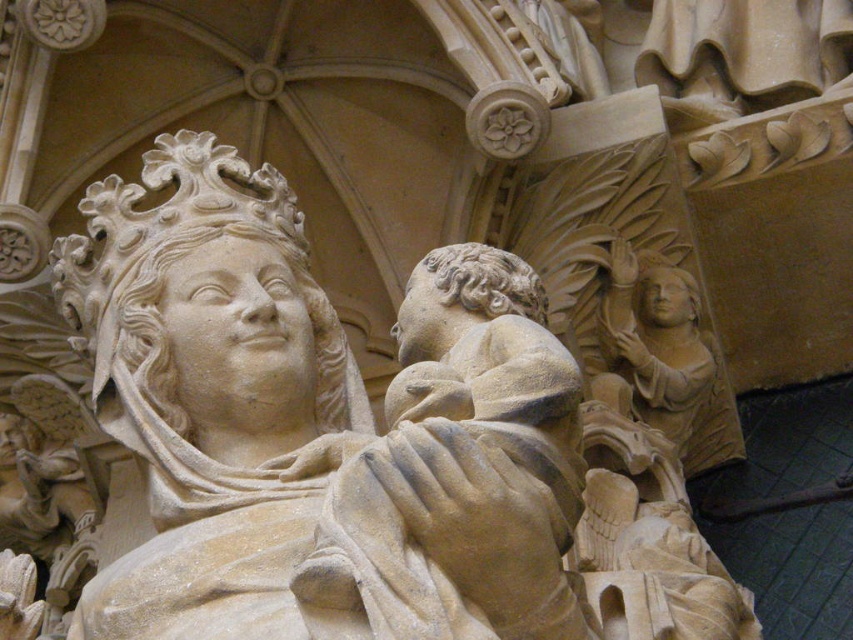
From the picture: Between stone statue of woman holding child at center and beige stone angel at right, which one is positioned higher?

Positioned higher is beige stone angel at right.

Between point (398, 406) and point (669, 280), which one is positioned behind?

The point (669, 280) is more distant.

Where is `stone statue of woman holding child at center`? The image size is (853, 640). stone statue of woman holding child at center is located at coordinates (316, 428).